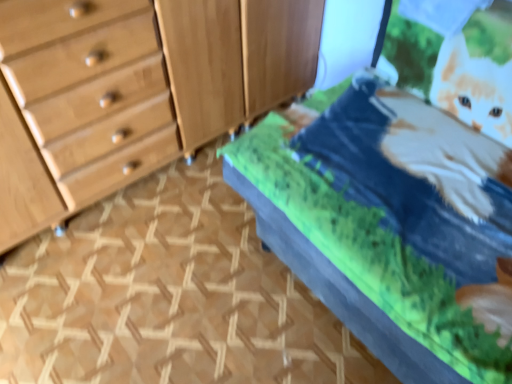
I want to click on light brown wood dresser at left, so click(138, 92).

Identify the location of light brown wood dresser at left. This screenshot has height=384, width=512. coord(138,92).

Is velvet green bed at center directly adjacent to light brown wood dresser at left?

velvet green bed at center and light brown wood dresser at left are clearly separated.

Based on the photo, is velvet green bed at center further to camera compared to light brown wood dresser at left?

No, velvet green bed at center is in front of light brown wood dresser at left.

From the image's perspective, would you say velvet green bed at center is positioned over light brown wood dresser at left?

No, from the image's perspective, velvet green bed at center is not above light brown wood dresser at left.

Considering the positions of objects wooden cabinet at center and velvet green bed at center in the image provided, who is behind, wooden cabinet at center or velvet green bed at center?

Result: wooden cabinet at center is behind.

Measure the distance between wooden cabinet at center and velvet green bed at center.

A distance of 64.97 centimeters exists between wooden cabinet at center and velvet green bed at center.

In order to click on cabinetry on the left of velvet green bed at center in this screenshot , I will do `click(236, 59)`.

Does wooden cabinet at center turn towards velvet green bed at center?

Yes, wooden cabinet at center is oriented towards velvet green bed at center.

Who is smaller, velvet green bed at center or wooden cabinet at center?

wooden cabinet at center is smaller.

How much distance is there between velvet green bed at center and wooden cabinet at center?

A distance of 25.58 inches exists between velvet green bed at center and wooden cabinet at center.

From a real-world perspective, is velvet green bed at center on wooden cabinet at center?

Correct, in the physical world, velvet green bed at center is higher than wooden cabinet at center.

Is velvet green bed at center positioned with its back to wooden cabinet at center?

No.

Is point (116, 26) closer or farther from the camera than point (203, 9)?

Point (116, 26) is closer to the camera than point (203, 9).

Is light brown wood dresser at left not close to wooden cabinet at center?

light brown wood dresser at left is actually quite close to wooden cabinet at center.

Considering the sizes of objects light brown wood dresser at left and wooden cabinet at center in the image provided, who is shorter, light brown wood dresser at left or wooden cabinet at center?

With less height is wooden cabinet at center.

How far apart are light brown wood dresser at left and wooden cabinet at center?

light brown wood dresser at left and wooden cabinet at center are 4.06 inches apart from each other.

Considering the sizes of light brown wood dresser at left and velvet green bed at center in the image, is light brown wood dresser at left bigger or smaller than velvet green bed at center?

Clearly, light brown wood dresser at left is smaller in size than velvet green bed at center.

Considering the relative positions of light brown wood dresser at left and velvet green bed at center in the image provided, is light brown wood dresser at left to the left or to the right of velvet green bed at center?

Clearly, light brown wood dresser at left is on the left of velvet green bed at center in the image.

Is light brown wood dresser at left facing towards velvet green bed at center?

Yes, light brown wood dresser at left is turned towards velvet green bed at center.

Is the position of wooden cabinet at center less distant than that of light brown wood dresser at left?

No.

From a real-world perspective, does wooden cabinet at center stand above light brown wood dresser at left?

No, from a real-world perspective, wooden cabinet at center is not over light brown wood dresser at left

From the image's perspective, would you say wooden cabinet at center is positioned over light brown wood dresser at left?

Yes.

What's the angular difference between wooden cabinet at center and light brown wood dresser at left's facing directions?

They differ by 0.901 degrees in their facing directions.

The image size is (512, 384). I want to click on bed lying below the light brown wood dresser at left (from the image's perspective), so pos(386,224).

The width and height of the screenshot is (512, 384). I want to click on bed that is on the right side of wooden cabinet at center, so click(x=386, y=224).

When comparing their distances from velvet green bed at center, does wooden cabinet at center or light brown wood dresser at left seem closer?

Among the two, wooden cabinet at center is located nearer to velvet green bed at center.

Estimate the real-world distances between objects in this image. Which object is further from velvet green bed at center, light brown wood dresser at left or wooden cabinet at center?

Based on the image, light brown wood dresser at left appears to be further to velvet green bed at center.

From the image, which object appears to be farther from wooden cabinet at center, light brown wood dresser at left or velvet green bed at center?

Based on the image, velvet green bed at center appears to be further to wooden cabinet at center.

When comparing their distances from light brown wood dresser at left, does wooden cabinet at center or velvet green bed at center seem closer?

wooden cabinet at center lies closer to light brown wood dresser at left than the other object.

Looking at the image, which one is located further to wooden cabinet at center, velvet green bed at center or light brown wood dresser at left?

velvet green bed at center is positioned further to the anchor wooden cabinet at center.

Considering their positions, is velvet green bed at center positioned further to light brown wood dresser at left than wooden cabinet at center?

velvet green bed at center.

Identify the location of cabinetry located between light brown wood dresser at left and velvet green bed at center in the left-right direction. This screenshot has height=384, width=512. (236, 59).